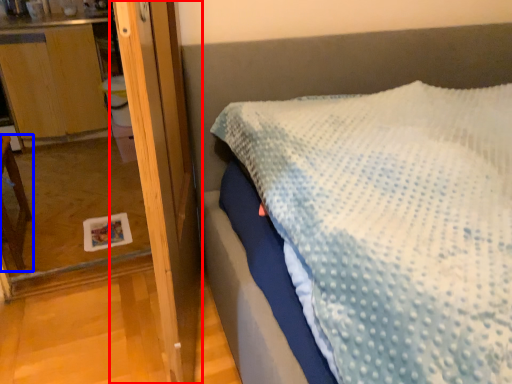
Question: Which object is further to the camera taking this photo, screen door (highlighted by a red box) or furniture (highlighted by a blue box)?

Choices:
 (A) screen door
 (B) furniture

Answer: (B)